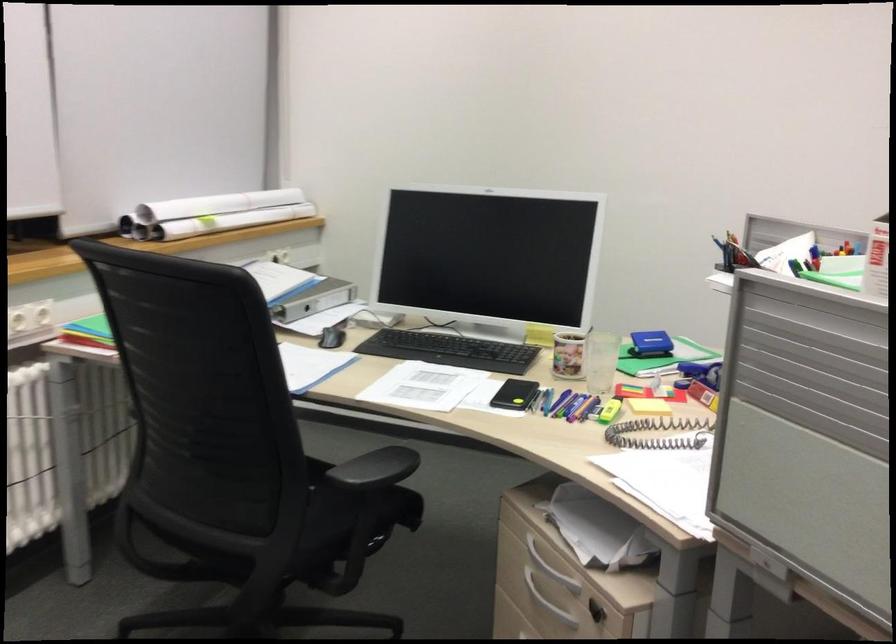
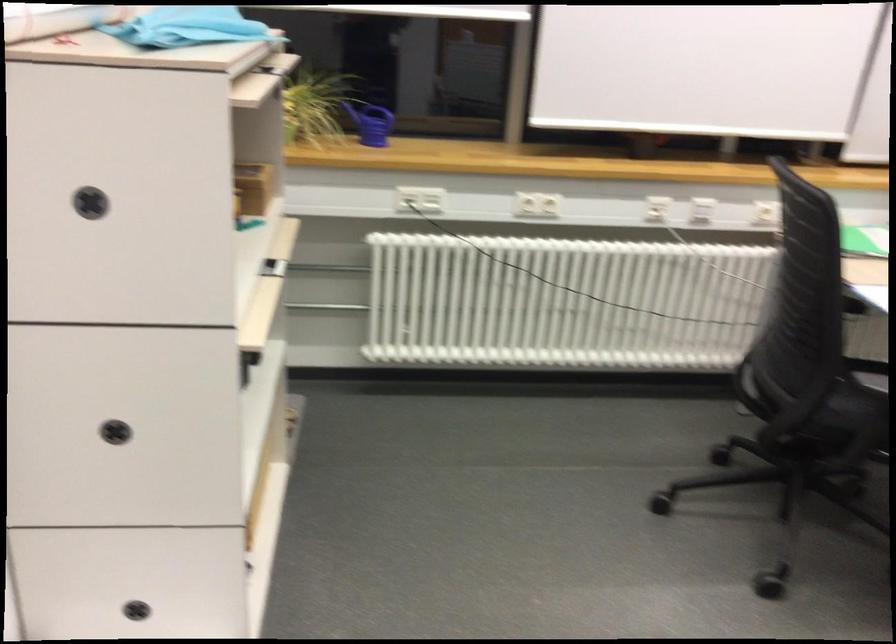
Based on the continuous images, in which direction is the camera rotating?

The camera's rotation is toward left-down.